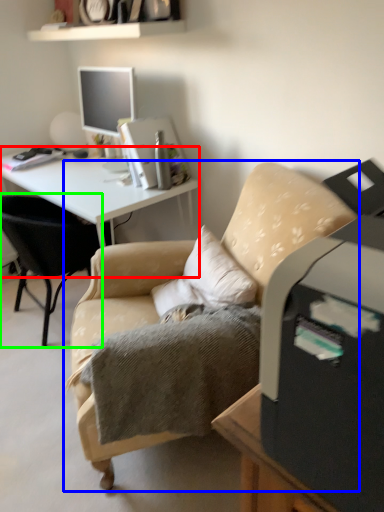
Question: Which is farther away from desk (highlighted by a red box)? chair (highlighted by a blue box) or chair (highlighted by a green box)?

Choices:
 (A) chair
 (B) chair

Answer: (A)